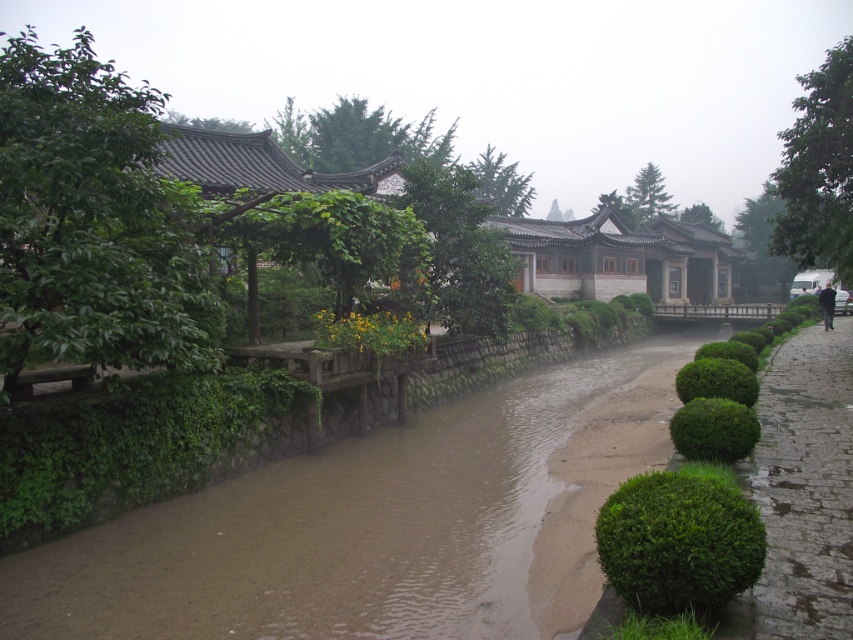
Which is more to the left, brown muddy water at center or paved stone path at right?

brown muddy water at center is more to the left.

Where is `brown muddy water at center`? This screenshot has height=640, width=853. brown muddy water at center is located at coordinates (378, 522).

The width and height of the screenshot is (853, 640). Find the location of `brown muddy water at center`. brown muddy water at center is located at coordinates (378, 522).